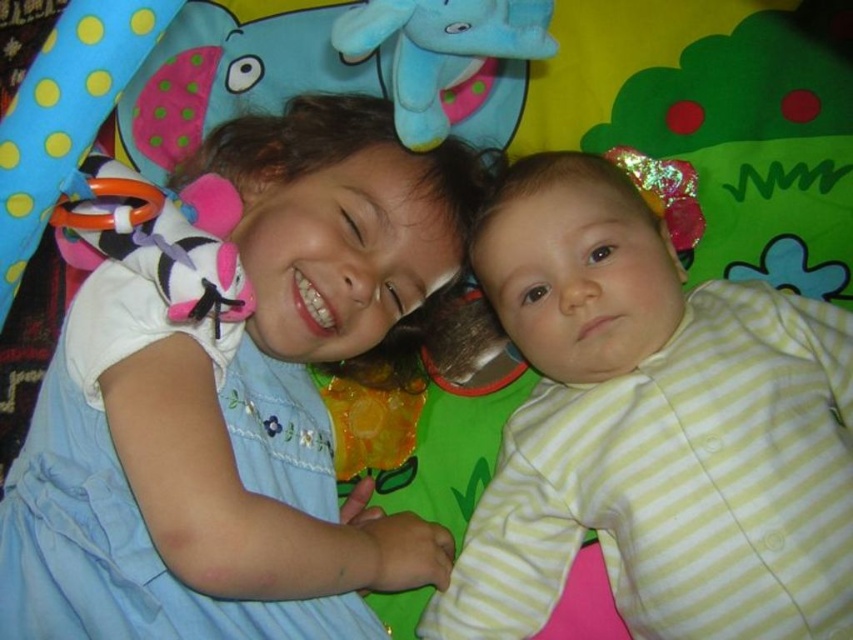
You are a photographer setting up for a family photo. You need to ensure that the matte blue dress at upper left and the yellow striped fabric at upper right are both visible in the frame. Given that the camera has a fixed focal length, which object should you prioritize positioning closer to the center of the frame to ensure both are fully visible?

Since the matte blue dress at upper left is wider than the yellow striped fabric at upper right, you should prioritize positioning the matte blue dress at upper left closer to the center of the frame to ensure both objects fit within the camera frame.

Based on the photo, you are a photographer setting up a shoot with two children on a play mat. You have a matte blue dress at upper left and a blue plush elephant at upper center in your setup. Which object is positioned higher from the ground?

The matte blue dress at upper left is taller than the blue plush elephant at upper center, so the matte blue dress at upper left is positioned higher from the ground.